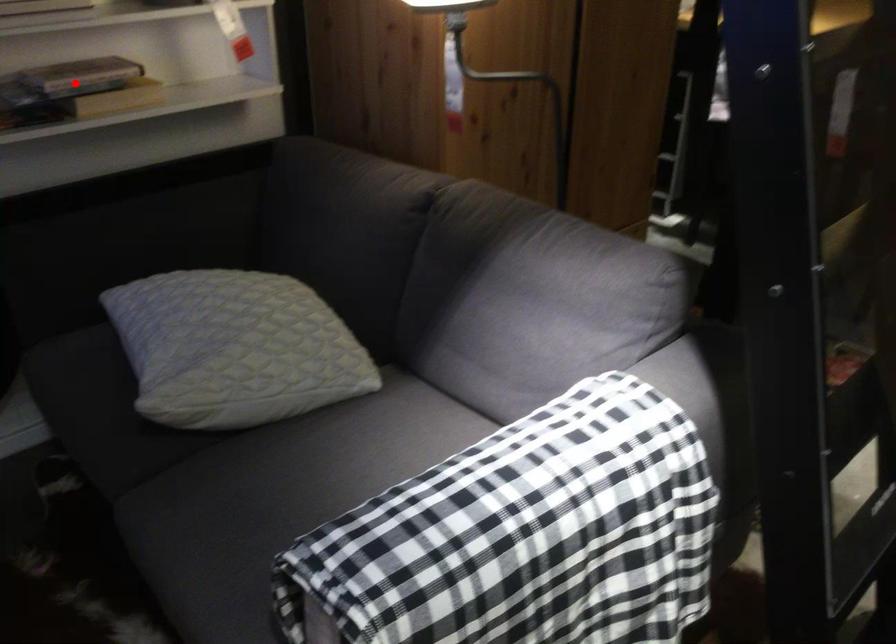
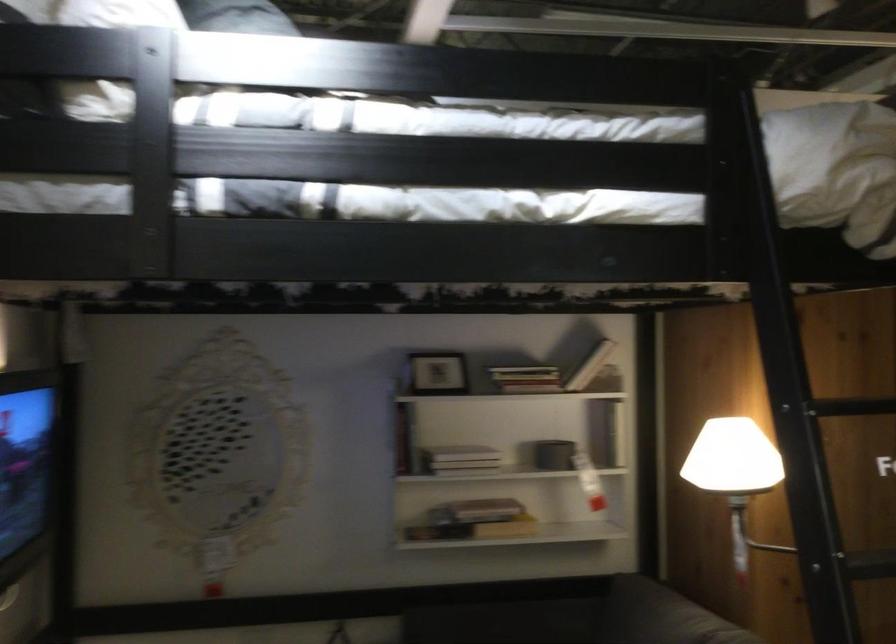
Where in the second image is the point corresponding to the highlighted location from the first image?

(476, 511)